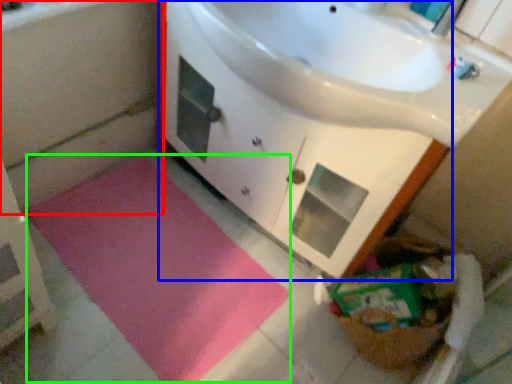
Question: Based on their relative distances, which object is farther from bath (highlighted by a red box)? Choose from bathroom cabinet (highlighted by a blue box) and bath mat (highlighted by a green box).

Choices:
 (A) bathroom cabinet
 (B) bath mat

Answer: (A)